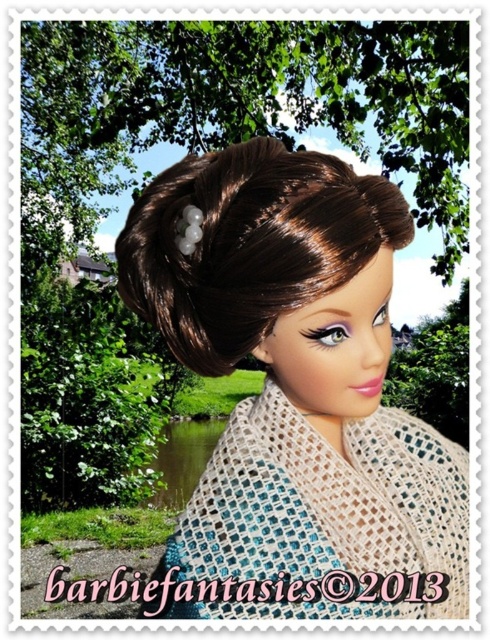
Question: Which point is farther to the camera?

Choices:
 (A) crochet beige shawl at center
 (B) brown shiny hair bun at center

Answer: (A)

Question: Is matte brown hair at center thinner than brown shiny hair bun at center?

Choices:
 (A) yes
 (B) no

Answer: (B)

Question: Estimate the real-world distances between objects in this image. Which object is closer to the matte brown hair at center?

Choices:
 (A) crochet beige shawl at center
 (B) brown shiny hair bun at center

Answer: (A)

Question: Considering the real-world distances, which object is farthest from the crochet beige shawl at center?

Choices:
 (A) brown shiny hair bun at center
 (B) matte brown hair at center

Answer: (A)

Question: Is the position of crochet beige shawl at center less distant than that of brown shiny hair bun at center?

Choices:
 (A) no
 (B) yes

Answer: (A)

Question: Does matte brown hair at center have a larger size compared to crochet beige shawl at center?

Choices:
 (A) no
 (B) yes

Answer: (B)